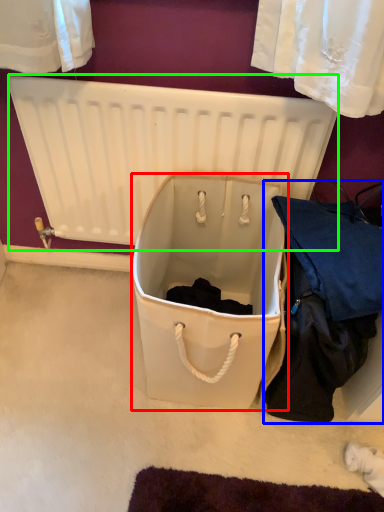
Question: Based on their relative distances, which object is farther from storage box (highlighted by a red box)? Choose from clothing (highlighted by a blue box) and radiator (highlighted by a green box).

Choices:
 (A) clothing
 (B) radiator

Answer: (B)